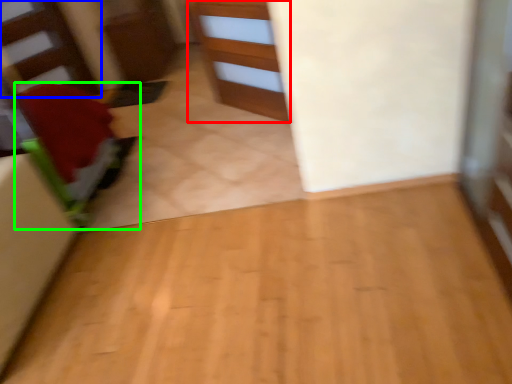
Question: Which is nearer to the cabinetry (highlighted by a red box)? stairwell (highlighted by a blue box) or furniture (highlighted by a green box).

Choices:
 (A) stairwell
 (B) furniture

Answer: (B)